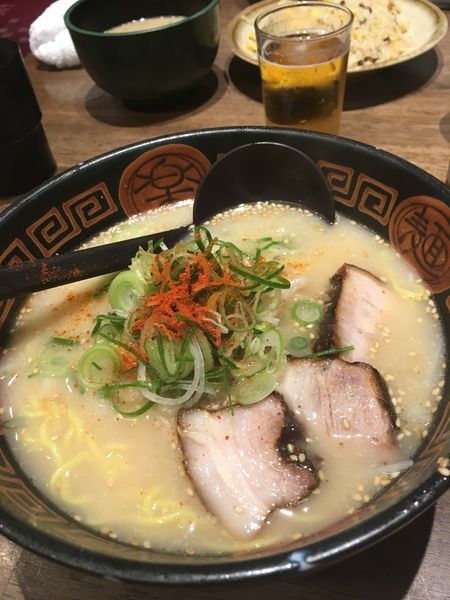
At what (x,y) coordinates should I click in order to perform the action: click on white rag. Please return your answer as a coordinate pair (x, y). The height and width of the screenshot is (600, 450). Looking at the image, I should click on (59, 48).